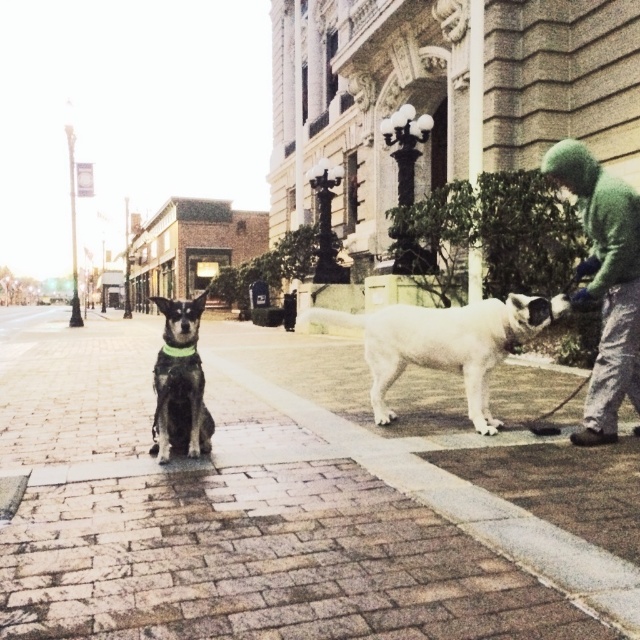
Question: Which of the following is the closest to the observer?

Choices:
 (A) (616, 268)
 (B) (189, 348)
 (C) (179, 413)

Answer: (B)

Question: Which point is farther to the camera?

Choices:
 (A) brick pavement at center
 (B) green fuzzy sweater at right

Answer: (B)

Question: Can you confirm if white fur dog at right is thinner than shiny black dog at center?

Choices:
 (A) yes
 (B) no

Answer: (B)

Question: Does white fur dog at right appear under shiny black dog at center?

Choices:
 (A) yes
 (B) no

Answer: (B)

Question: Can you confirm if green fuzzy sweater at right is thinner than green fabric neckband at center?

Choices:
 (A) yes
 (B) no

Answer: (B)

Question: Estimate the real-world distances between objects in this image. Which object is closer to the green fabric neckband at center?

Choices:
 (A) white fur dog at right
 (B) brick pavement at center
 (C) shiny black dog at center
 (D) green fuzzy sweater at right

Answer: (C)